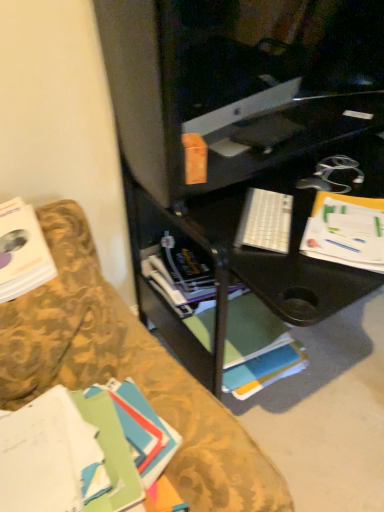
Question: From a real-world perspective, is green matte book at lower left, marked as the third book in a back-to-front arrangement, physically located above or below white plastic keyboard at center?

Choices:
 (A) below
 (B) above

Answer: (A)

Question: Considering the positions of point (109, 450) and point (286, 252), is point (109, 450) closer or farther from the camera than point (286, 252)?

Choices:
 (A) closer
 (B) farther

Answer: (A)

Question: Which is nearer to the white plastic keyboard at center?

Choices:
 (A) green matte book at lower left, marked as the third book in a back-to-front arrangement
 (B) white paper at right
 (C) white matte book at center, the 3th book positioned from the front
 (D) white paper book at left, placed as the 2th book when sorted from front to back

Answer: (B)

Question: Which of these objects is positioned closest to the green matte book at lower left, marked as the third book in a back-to-front arrangement?

Choices:
 (A) white matte book at center, which is the first book in back-to-front order
 (B) white paper at right
 (C) white paper book at left, marked as the 2th book in a back-to-front arrangement
 (D) white plastic keyboard at center

Answer: (C)